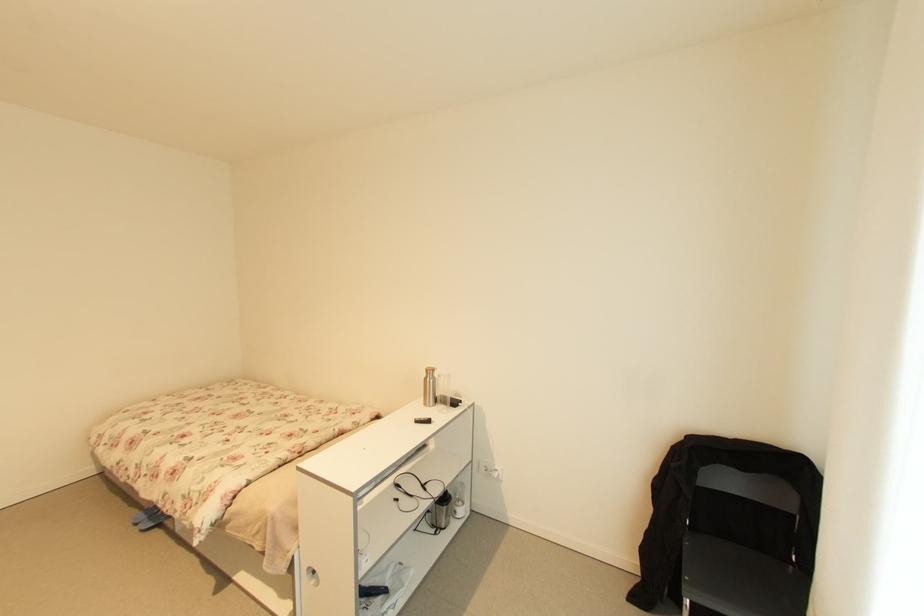
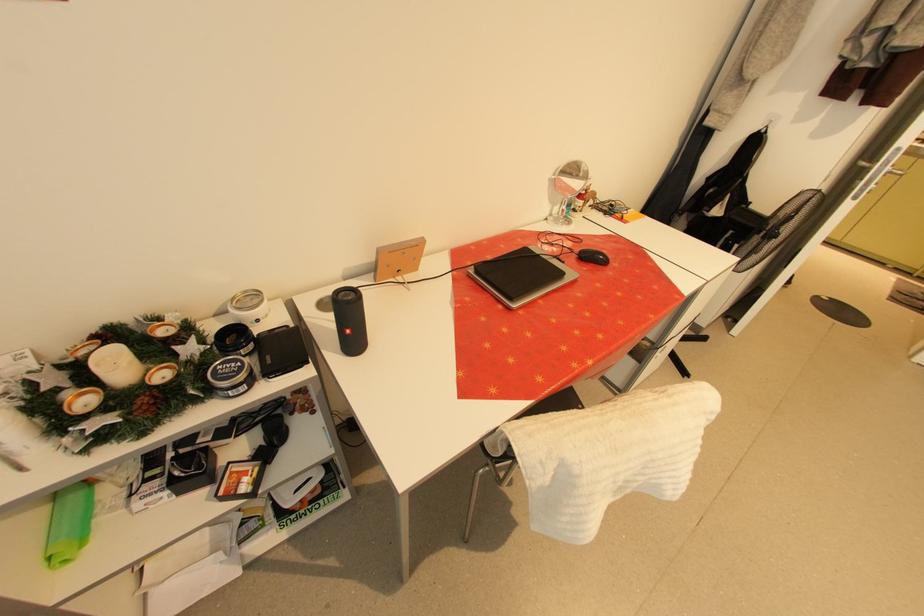
How did the camera likely rotate?

The camera rotated toward left-down.